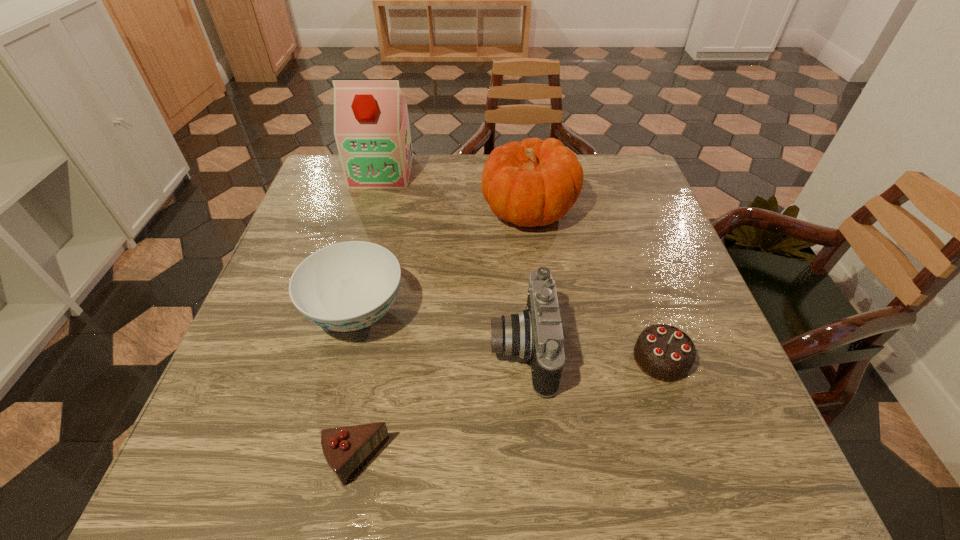
You are a GUI agent. You are given a task and a screenshot of the screen. Output one action in this format:
    pyautogui.click(x=<x>, y=<y>)
    Task: Click on the vacant space that satisfies the following two spatial constraints: 1. on the front side of the pumpkin; 2. on the front-facing side of the fourth shortest object
    The height and width of the screenshot is (540, 960).
    Given the screenshot: What is the action you would take?
    pyautogui.click(x=545, y=348)

At what (x,y) coordinates should I click in order to perform the action: click on vacant region that satisfies the following two spatial constraints: 1. with the cap open on the left chocolate cake; 2. on the right side of the tallest object. Please return your answer as a coordinate pair (x, y). The height and width of the screenshot is (540, 960). Looking at the image, I should click on (301, 461).

The height and width of the screenshot is (540, 960). Find the location of `blank space that satisfies the following two spatial constraints: 1. on the back side of the nearer chocolate cake; 2. on the right side of the right chocolate cake`. blank space that satisfies the following two spatial constraints: 1. on the back side of the nearer chocolate cake; 2. on the right side of the right chocolate cake is located at coordinates (376, 359).

You are a GUI agent. You are given a task and a screenshot of the screen. Output one action in this format:
    pyautogui.click(x=<x>, y=<y>)
    Task: Click on the vacant area in the image that satisfies the following two spatial constraints: 1. with the cap open on the soya milk; 2. on the right side of the rightmost object
    The height and width of the screenshot is (540, 960).
    Given the screenshot: What is the action you would take?
    pyautogui.click(x=330, y=359)

Image resolution: width=960 pixels, height=540 pixels. I want to click on vacant position in the image that satisfies the following two spatial constraints: 1. on the front-facing side of the right chocolate cake; 2. on the left side of the third tallest object, so click(522, 359).